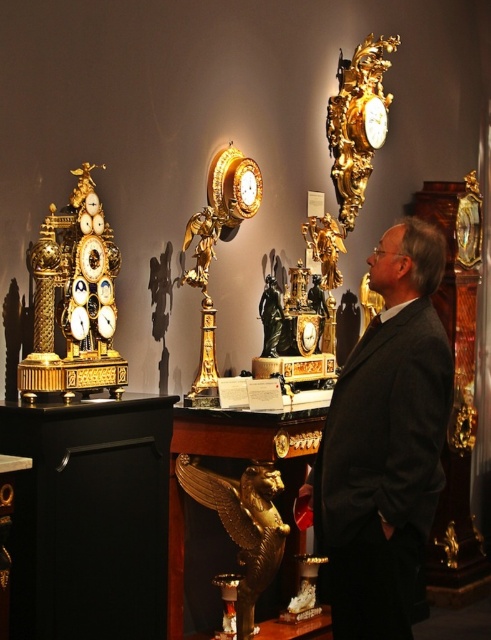
Who is more forward, (x=357, y=477) or (x=245, y=189)?

Point (x=357, y=477)

Between black suit at center and gold/gilded clock at center, which one has more height?

Standing taller between the two is black suit at center.

This screenshot has height=640, width=491. I want to click on black suit at center, so click(385, 442).

Which is more to the left, black suit at center or gold polished eagle at center?

From the viewer's perspective, gold polished eagle at center appears more on the left side.

Does black suit at center appear under gold polished eagle at center?

No, black suit at center is not below gold polished eagle at center.

Measure the distance between point (348, 593) and camera.

The distance of point (348, 593) from camera is 5.63 meters.

You are a GUI agent. You are given a task and a screenshot of the screen. Output one action in this format:
    pyautogui.click(x=<x>, y=<y>)
    Task: Click on the black suit at center
    This screenshot has height=640, width=491.
    Given the screenshot: What is the action you would take?
    pyautogui.click(x=385, y=442)

Based on the photo, which is below, gold/gilded clock at left or gold/gilded ornate clock at upper right?

gold/gilded clock at left is below.

The width and height of the screenshot is (491, 640). Identify the location of gold/gilded clock at left. (75, 300).

Where is `gold/gilded clock at left`? gold/gilded clock at left is located at coordinates (75, 300).